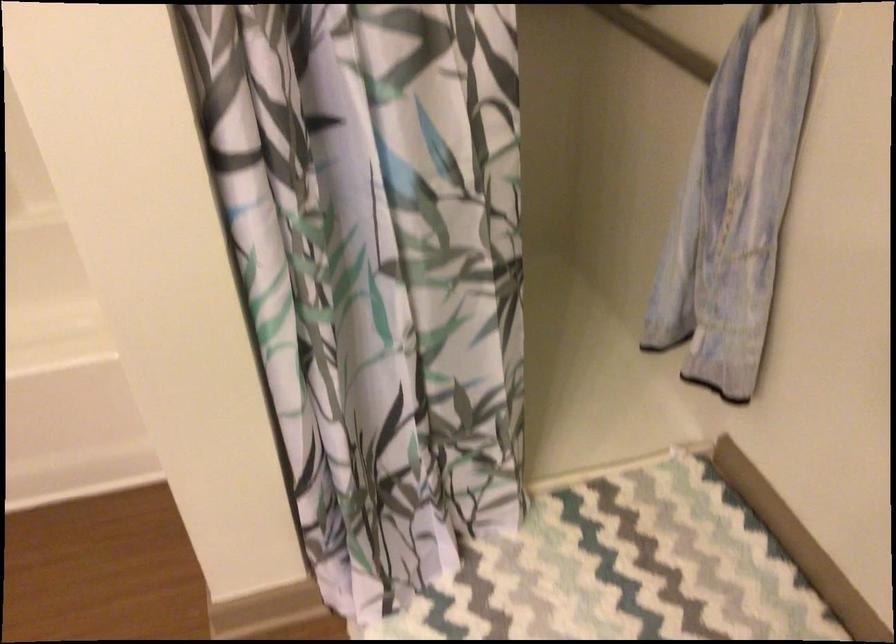
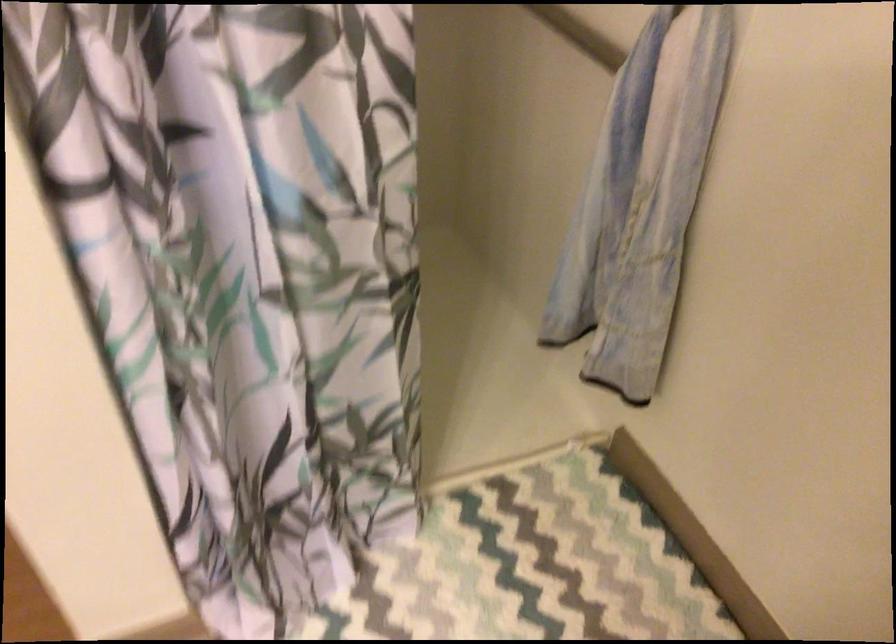
Question: The images are taken continuously from a first-person perspective. In which direction are you moving?

Choices:
 (A) Left
 (B) Right
 (C) Forward
 (D) Backward

Answer: (C)